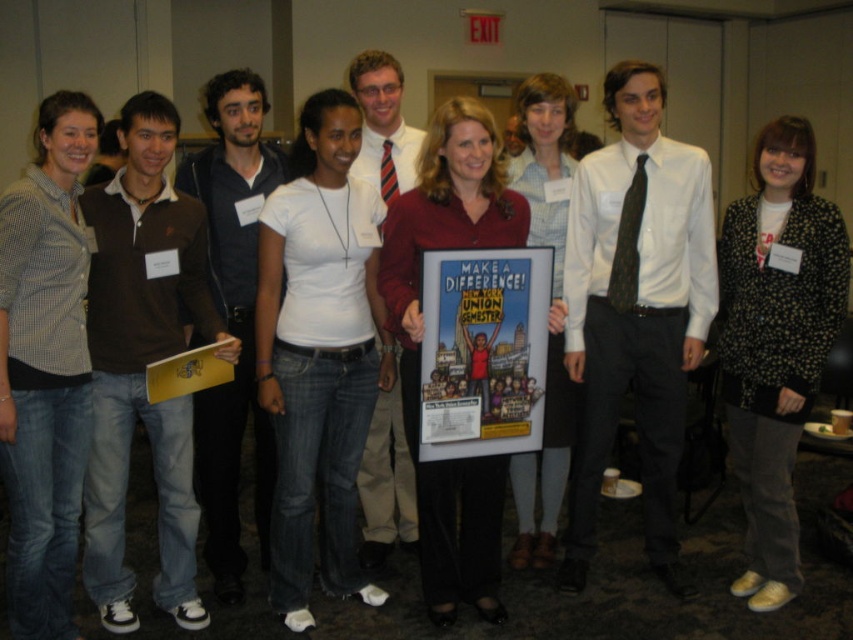
Does white matte shirt at center have a greater width compared to black dotted blazer at center?

Correct, the width of white matte shirt at center exceeds that of black dotted blazer at center.

Measure the distance between white matte shirt at center and black dotted blazer at center.

The distance of white matte shirt at center from black dotted blazer at center is 1.34 meters.

You are a GUI agent. You are given a task and a screenshot of the screen. Output one action in this format:
    pyautogui.click(x=<x>, y=<y>)
    Task: Click on the white matte shirt at center
    
    Given the screenshot: What is the action you would take?
    pyautogui.click(x=318, y=353)

Where is `white matte shirt at center`? The height and width of the screenshot is (640, 853). white matte shirt at center is located at coordinates (318, 353).

I want to click on white matte shirt at center, so click(x=318, y=353).

Which is in front, point (340, 332) or point (535, 396)?

Point (535, 396) is more forward.

Locate an element on the screen. This screenshot has height=640, width=853. white matte shirt at center is located at coordinates (318, 353).

Is point (784, 339) positioned before point (515, 353)?

No, (784, 339) is behind (515, 353).

Between black dotted blazer at center and cartoon-style poster at center, which one appears on the left side from the viewer's perspective?

cartoon-style poster at center is more to the left.

Which is behind, point (772, 452) or point (447, 422)?

Point (772, 452)

Find the location of a particular element. Image resolution: width=853 pixels, height=640 pixels. black dotted blazer at center is located at coordinates pyautogui.click(x=776, y=342).